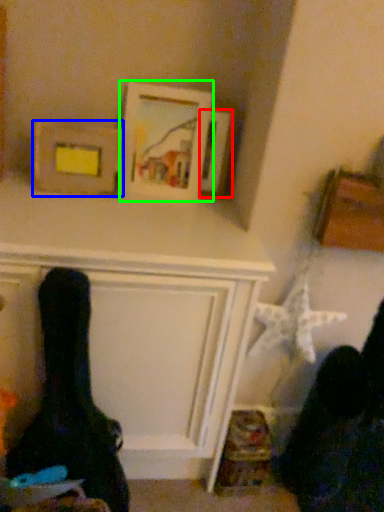
Question: Based on their relative distances, which object is nearer to picture frame (highlighted by a red box)? Choose from picture frame (highlighted by a blue box) and picture frame (highlighted by a green box).

Choices:
 (A) picture frame
 (B) picture frame

Answer: (B)